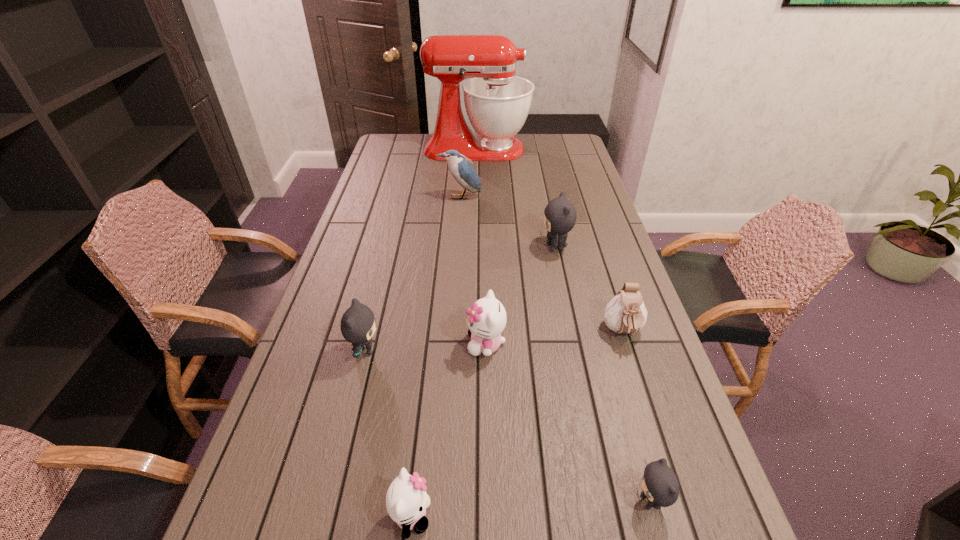
Where is `mixer`? The image size is (960, 540). mixer is located at coordinates (497, 102).

What are the coordinates of `red mixer` in the screenshot? It's located at (497, 102).

Locate an element on the screen. Image resolution: width=960 pixels, height=540 pixels. the seventh nearest object is located at coordinates (461, 169).

The image size is (960, 540). I want to click on bird, so click(461, 169).

This screenshot has height=540, width=960. I want to click on the biggest gray kitten, so click(x=560, y=215).

You are a GUI agent. You are given a task and a screenshot of the screen. Output one action in this format:
    pyautogui.click(x=<x>, y=<y>)
    Task: Click on the sixth nearest object
    This screenshot has height=540, width=960.
    Given the screenshot: What is the action you would take?
    pyautogui.click(x=560, y=215)

You are a GUI agent. You are given a task and a screenshot of the screen. Output one action in this format:
    pyautogui.click(x=<x>, y=<y>)
    Task: Click on the bigger white kitten
    The height and width of the screenshot is (540, 960).
    Given the screenshot: What is the action you would take?
    pyautogui.click(x=486, y=320)

I want to click on the farther white kitten, so click(486, 320).

This screenshot has height=540, width=960. I want to click on the second biggest gray kitten, so click(x=357, y=325).

What are the coordinates of `the second nearest gray kitten` in the screenshot? It's located at (357, 325).